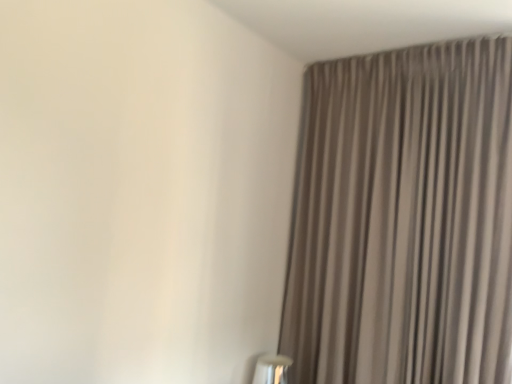
Question: From a real-world perspective, is white glossy table lamp at lower right above or below neutral striped curtain at right?

Choices:
 (A) above
 (B) below

Answer: (B)

Question: Considering their positions, is white glossy table lamp at lower right located in front of or behind neutral striped curtain at right?

Choices:
 (A) front
 (B) behind

Answer: (B)

Question: From the image's perspective, is white glossy table lamp at lower right above or below neutral striped curtain at right?

Choices:
 (A) above
 (B) below

Answer: (B)

Question: Is neutral striped curtain at right wider or thinner than white glossy table lamp at lower right?

Choices:
 (A) thin
 (B) wide

Answer: (B)

Question: From a real-world perspective, relative to white glossy table lamp at lower right, is neutral striped curtain at right vertically above or below?

Choices:
 (A) above
 (B) below

Answer: (A)

Question: Is neutral striped curtain at right bigger or smaller than white glossy table lamp at lower right?

Choices:
 (A) small
 (B) big

Answer: (B)

Question: Is neutral striped curtain at right to the left or to the right of white glossy table lamp at lower right in the image?

Choices:
 (A) right
 (B) left

Answer: (A)